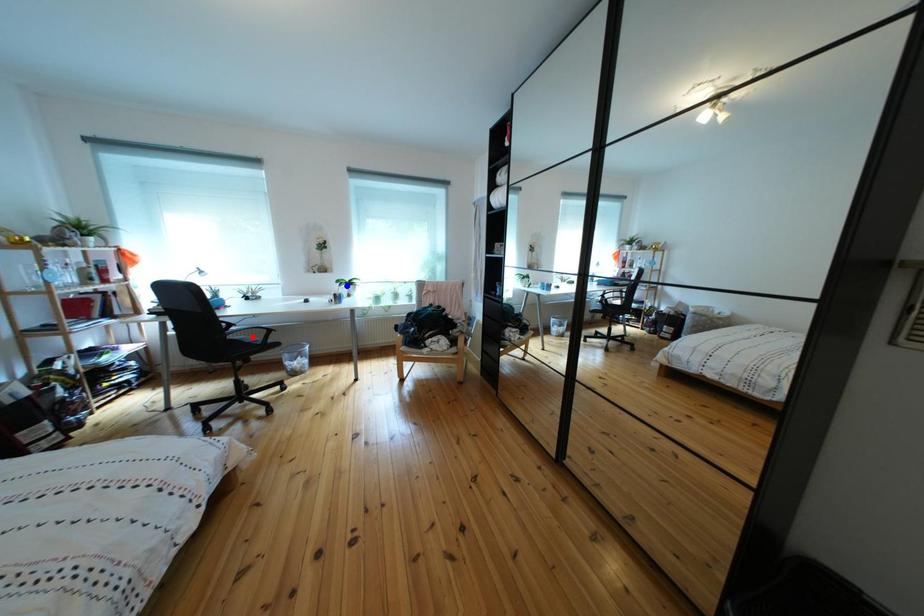
Question: Which of the two points in the image is closer to the camera?

Choices:
 (A) Blue point is closer.
 (B) Red point is closer.

Answer: (B)